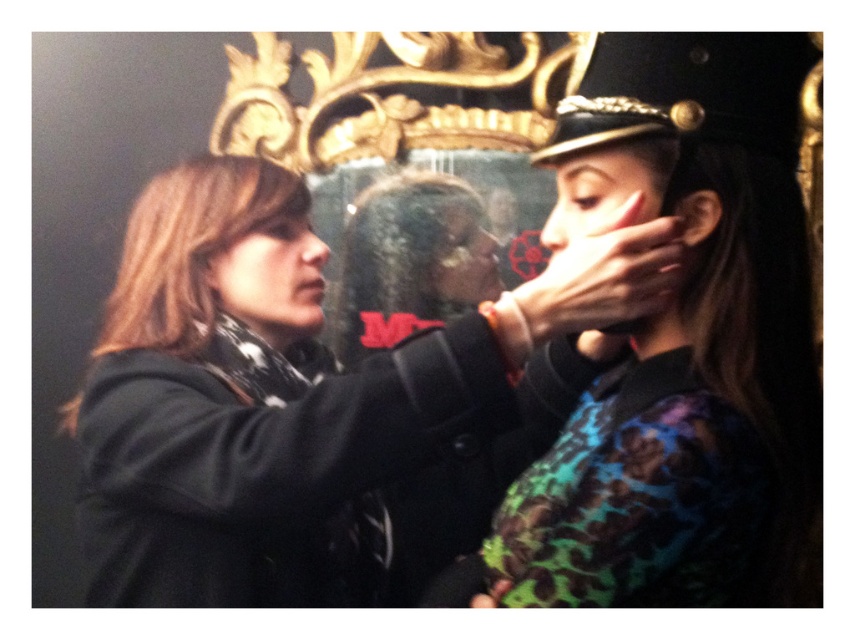
Question: Which object appears farthest from the camera in this image?

Choices:
 (A) matte black face at center
 (B) shiny black hat at upper right

Answer: (A)

Question: Which of these objects is positioned closest to the matte black jacket at center?

Choices:
 (A) matte black face at upper right
 (B) shiny black hat at upper right

Answer: (B)

Question: Can you confirm if matte black face at upper right is positioned to the left of matte black hat at upper center?

Choices:
 (A) yes
 (B) no

Answer: (A)

Question: Observing the image, what is the correct spatial positioning of matte black scarf at left in reference to matte black face at center?

Choices:
 (A) left
 (B) right

Answer: (A)

Question: Which of the following is the closest to the observer?

Choices:
 (A) (564, 154)
 (B) (612, 157)
 (C) (605, 451)
 (D) (452, 252)

Answer: (C)

Question: Does matte black face at upper right have a larger size compared to matte black face at center?

Choices:
 (A) yes
 (B) no

Answer: (A)